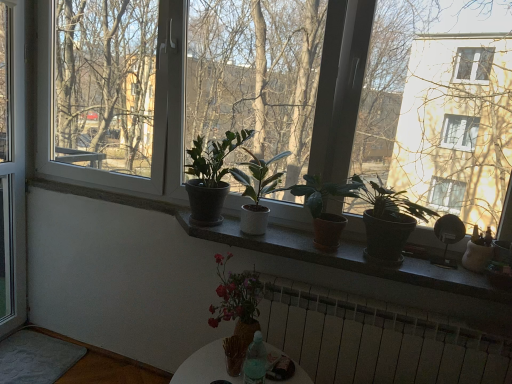
Question: Is matte concrete window sill at center facing towards white metallic radiator at lower center?

Choices:
 (A) yes
 (B) no

Answer: (B)

Question: Is matte concrete window sill at center in front of white metallic radiator at lower center?

Choices:
 (A) yes
 (B) no

Answer: (A)

Question: From a real-world perspective, is matte concrete window sill at center physically above white metallic radiator at lower center?

Choices:
 (A) no
 (B) yes

Answer: (B)

Question: Is matte concrete window sill at center to the right of white metallic radiator at lower center from the viewer's perspective?

Choices:
 (A) yes
 (B) no

Answer: (B)

Question: Can you confirm if matte concrete window sill at center is bigger than white metallic radiator at lower center?

Choices:
 (A) no
 (B) yes

Answer: (A)

Question: Considering their positions, is transparent glass window at left located in front of or behind pink matte vase at center, positioned as the 4th houseplant in right-to-left order?

Choices:
 (A) front
 (B) behind

Answer: (B)

Question: From a real-world perspective, is transparent glass window at left physically located above or below pink matte vase at center, positioned as the 4th houseplant in right-to-left order?

Choices:
 (A) below
 (B) above

Answer: (B)

Question: Looking at their shapes, would you say transparent glass window at left is wider or thinner than pink matte vase at center, positioned as the 4th houseplant in right-to-left order?

Choices:
 (A) thin
 (B) wide

Answer: (A)

Question: Considering the positions of point (1, 46) and point (234, 309), is point (1, 46) closer or farther from the camera than point (234, 309)?

Choices:
 (A) farther
 (B) closer

Answer: (A)

Question: Is transparent glass window at left inside or outside of matte black pot at center, positioned as the first houseplant in left-to-right order?

Choices:
 (A) outside
 (B) inside

Answer: (A)

Question: Is point (13, 180) positioned closer to the camera than point (217, 153)?

Choices:
 (A) farther
 (B) closer

Answer: (A)

Question: Looking at their shapes, would you say transparent glass window at left is wider or thinner than matte black pot at center, which ranks as the fifth houseplant in right-to-left order?

Choices:
 (A) wide
 (B) thin

Answer: (B)

Question: From their relative heights in the image, would you say transparent glass window at left is taller or shorter than matte black pot at center, positioned as the first houseplant in left-to-right order?

Choices:
 (A) short
 (B) tall

Answer: (B)

Question: Is brown terracotta pot at center, positioned as the 4th houseplant in left-to-right order, taller or shorter than matte black pot at center, which ranks as the 5th houseplant in left-to-right order?

Choices:
 (A) short
 (B) tall

Answer: (A)

Question: From the image's perspective, is brown terracotta pot at center, positioned as the 4th houseplant in left-to-right order, above or below matte black pot at center, the 1th houseplant viewed from the right?

Choices:
 (A) above
 (B) below

Answer: (A)